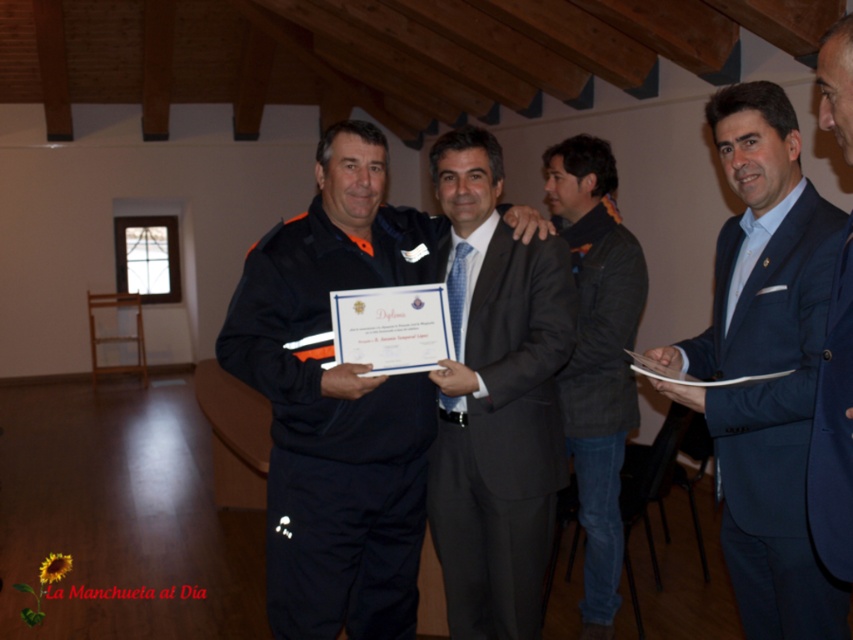
You are a photographer at this event and need to position a camera stand between the matte black uniform at center and the blue suit at right. Since the camera stand requires 1.2 meters of space, can you fit it between them based on their sizes?

The matte black uniform at center is bigger than the blue suit at right. However, the size difference alone does not provide exact measurements of the space between them. Without knowing the actual distance between the two, it is impossible to determine if the camera stand will fit.

You are organizing a photo shoot and need to place two props on a table. The matte black uniform at center and the dark gray textured jacket at center must be arranged so that they don not overlap. Given their sizes, which object should you place closer to the edge of the table to ensure there is enough space for both?

The matte black uniform at center occupies less space than the dark gray textured jacket at center, so you should place the matte black uniform at center closer to the edge to leave more space for the larger dark gray textured jacket at center.